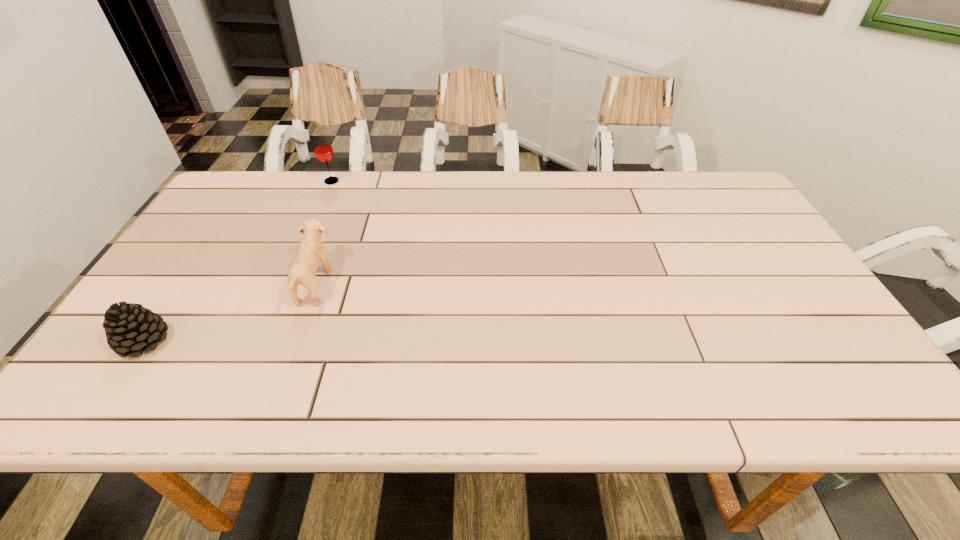
Find the location of `free area in between the shortest object and the rightmost object`. free area in between the shortest object and the rightmost object is located at coordinates (229, 313).

The width and height of the screenshot is (960, 540). What are the coordinates of `empty space between the shortest object and the puppy` in the screenshot? It's located at (229, 313).

Image resolution: width=960 pixels, height=540 pixels. In order to click on vacant region between the puppy and the glass in this screenshot , I will do click(324, 233).

You are a GUI agent. You are given a task and a screenshot of the screen. Output one action in this format:
    pyautogui.click(x=<x>, y=<y>)
    Task: Click on the free space between the puppy and the shortest object
    This screenshot has width=960, height=540.
    Given the screenshot: What is the action you would take?
    pyautogui.click(x=229, y=313)

At what (x,y) coordinates should I click in order to perform the action: click on free point between the rightmost object and the shortest object. Please return your answer as a coordinate pair (x, y). The height and width of the screenshot is (540, 960). Looking at the image, I should click on (229, 313).

You are a GUI agent. You are given a task and a screenshot of the screen. Output one action in this format:
    pyautogui.click(x=<x>, y=<y>)
    Task: Click on the vacant space in between the glass and the puppy
    The width and height of the screenshot is (960, 540).
    Given the screenshot: What is the action you would take?
    pyautogui.click(x=324, y=233)

This screenshot has width=960, height=540. I want to click on empty location between the rightmost object and the second object from left to right, so click(x=324, y=233).

Identify which object is the nearest to the rightmost object. Please provide its 2D coordinates. Your answer should be formatted as a tuple, i.e. [(x, y)], where the tuple contains the x and y coordinates of a point satisfying the conditions above.

[(130, 328)]

You are a GUI agent. You are given a task and a screenshot of the screen. Output one action in this format:
    pyautogui.click(x=<x>, y=<y>)
    Task: Click on the object that is the second closest to the puppy
    This screenshot has height=540, width=960.
    Given the screenshot: What is the action you would take?
    pyautogui.click(x=323, y=150)

Where is `free space that satisfies the following two spatial constraints: 1. on the front side of the second object from left to right; 2. at the narrow end of the pinecone`? free space that satisfies the following two spatial constraints: 1. on the front side of the second object from left to right; 2. at the narrow end of the pinecone is located at coordinates (263, 341).